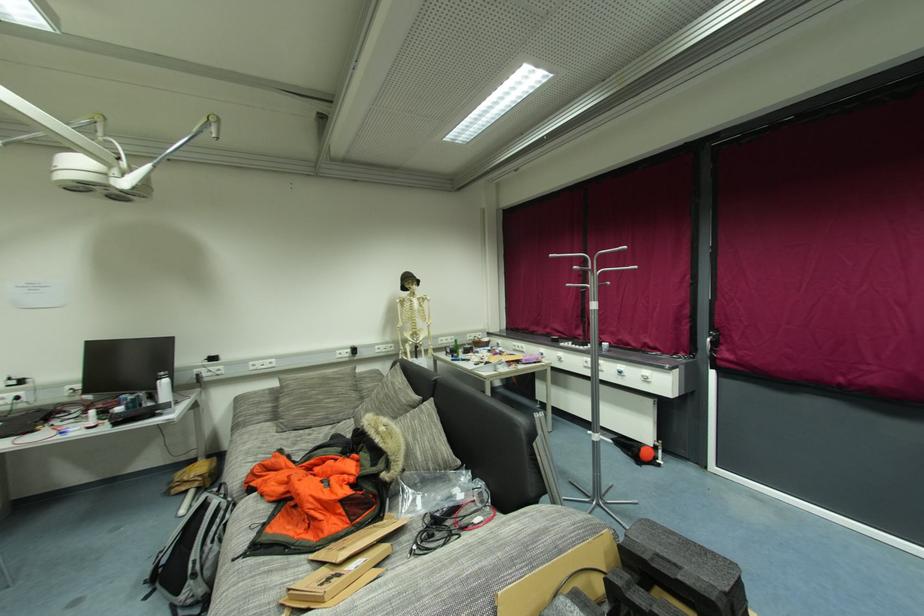
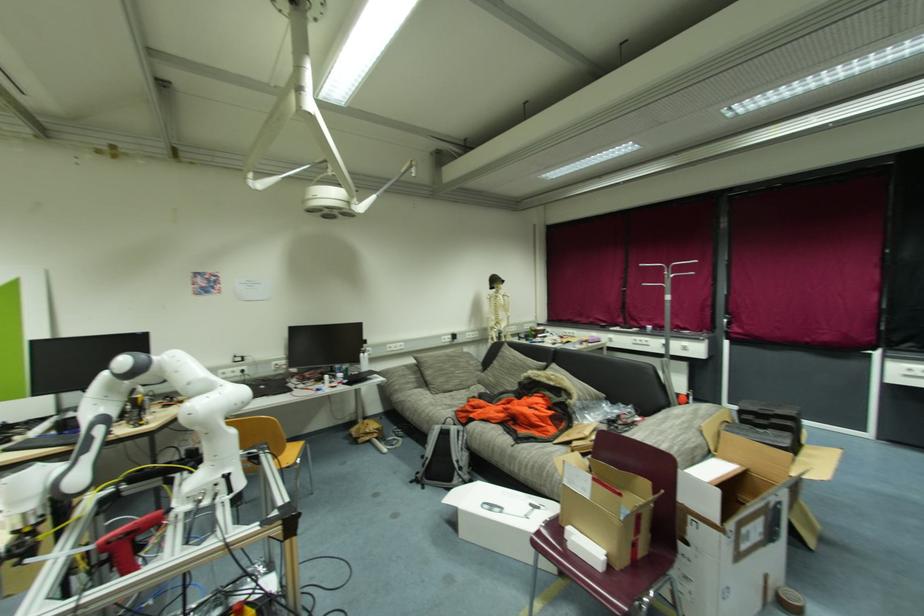
In a continuous first-person perspective shot, in which direction is the camera moving?

The cameraman walked toward left, backward.